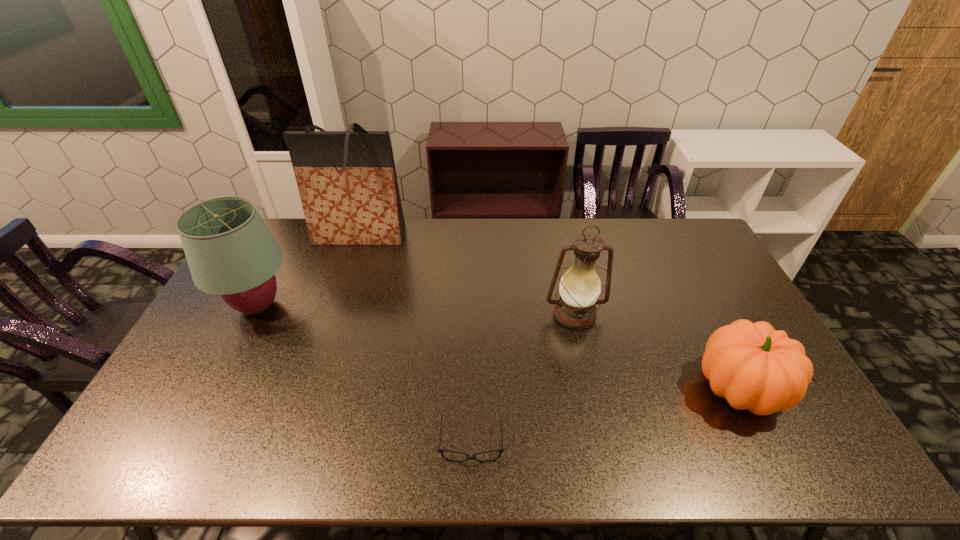
The height and width of the screenshot is (540, 960). I want to click on unoccupied area between the oil lamp and the pumpkin, so click(657, 352).

Locate an element on the screen. free space between the rightmost object and the oil lamp is located at coordinates (657, 352).

The height and width of the screenshot is (540, 960). I want to click on free spot between the rightmost object and the oil lamp, so click(x=657, y=352).

In order to click on free spot between the third object from left to right and the tallest object in this screenshot , I will do `click(416, 339)`.

The height and width of the screenshot is (540, 960). What are the coordinates of `free point between the second shortest object and the third object from right to left` in the screenshot? It's located at (606, 415).

The image size is (960, 540). In order to click on empty space between the lampshade and the oil lamp in this screenshot , I will do `click(417, 310)`.

Find the location of a particular element. This screenshot has width=960, height=540. vacant space that's between the oil lamp and the lampshade is located at coordinates (417, 310).

You are a GUI agent. You are given a task and a screenshot of the screen. Output one action in this format:
    pyautogui.click(x=<x>, y=<y>)
    Task: Click on the free space between the farthest object and the oil lamp
    Image resolution: width=960 pixels, height=540 pixels.
    Given the screenshot: What is the action you would take?
    pyautogui.click(x=467, y=275)

Where is `object that is the third closest one to the lampshade`? The height and width of the screenshot is (540, 960). object that is the third closest one to the lampshade is located at coordinates (580, 287).

The width and height of the screenshot is (960, 540). In order to click on object that stands as the third closest to the fourth object from left to right in this screenshot , I will do `click(347, 181)`.